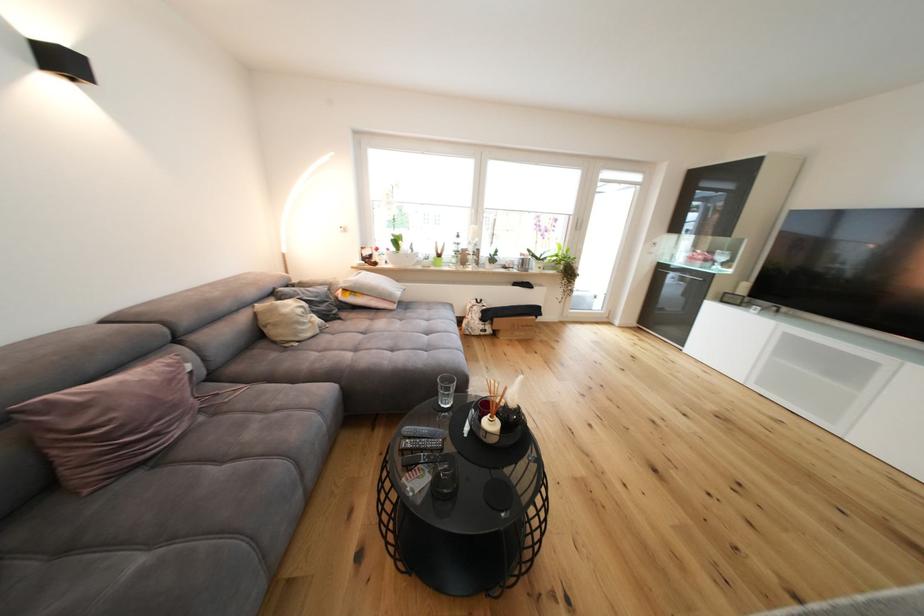
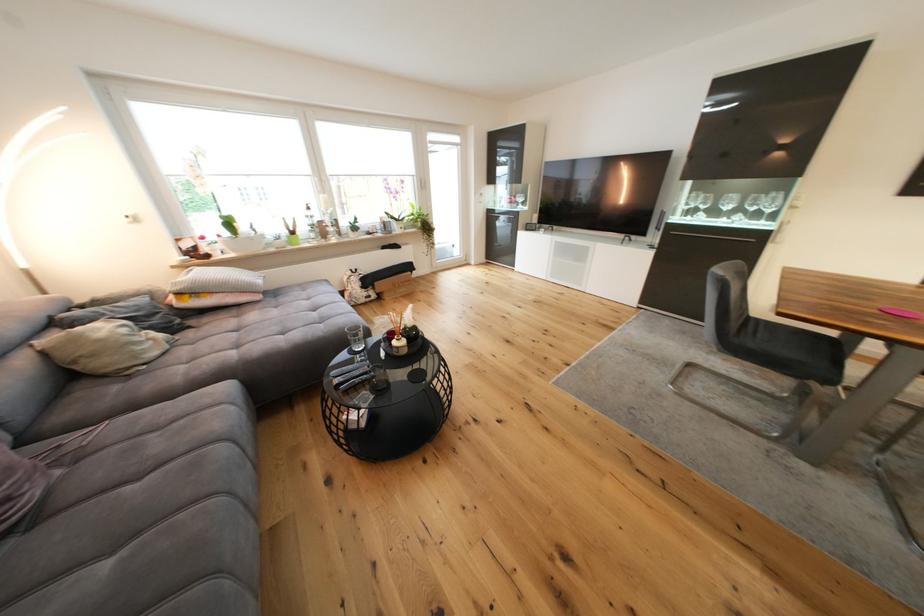
The point at [329,331] is marked in the first image. Where is the corresponding point in the second image?

(178, 345)